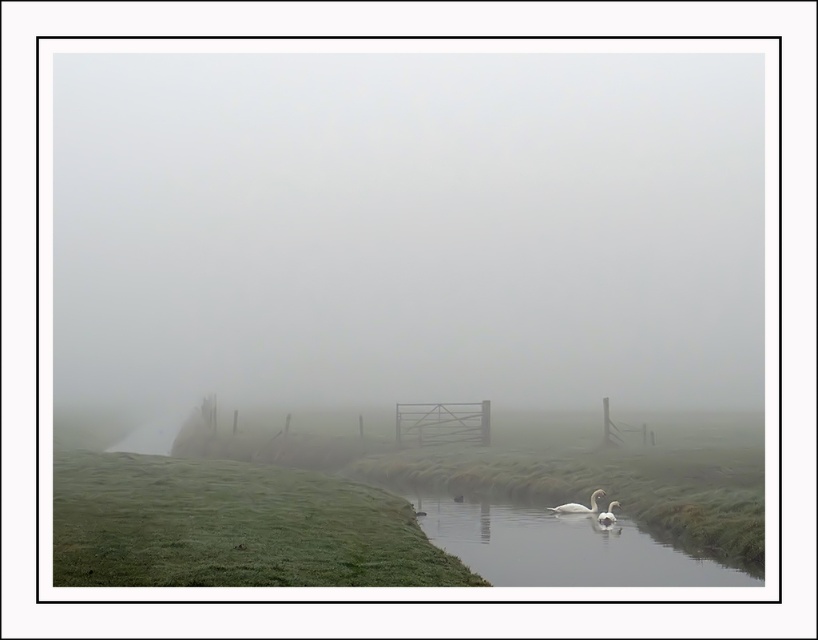
Question: Which point is farther to the camera?

Choices:
 (A) (502, 545)
 (B) (587, 509)

Answer: (B)

Question: Which of the following is the farthest from the observer?

Choices:
 (A) (420, 170)
 (B) (52, 468)
 (C) (590, 532)
 (D) (596, 518)

Answer: (A)

Question: Can you confirm if foggy mist at center is positioned to the left of white glossy swan at lower center?

Choices:
 (A) no
 (B) yes

Answer: (A)

Question: Does foggy mist at center appear over white matte swan at lower center?

Choices:
 (A) no
 (B) yes

Answer: (B)

Question: Can you confirm if foggy mist at center is thinner than white matte swan at lower center?

Choices:
 (A) no
 (B) yes

Answer: (A)

Question: Among these objects, which one is farthest from the camera?

Choices:
 (A) white glossy swan at lower center
 (B) green grassy hillside at lower left
 (C) white matte swan at lower center

Answer: (C)